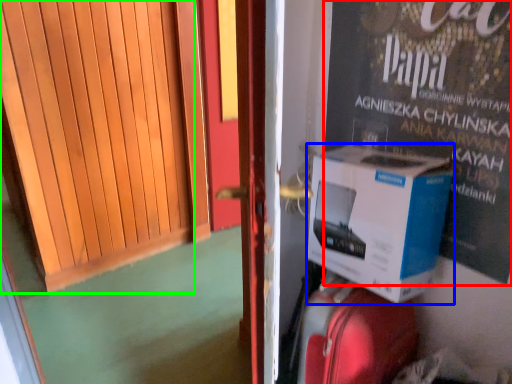
Question: Which object is the closest to the advertisement (highlighted by a red box)? Choose among these: box (highlighted by a blue box) or door (highlighted by a green box).

Choices:
 (A) box
 (B) door

Answer: (A)